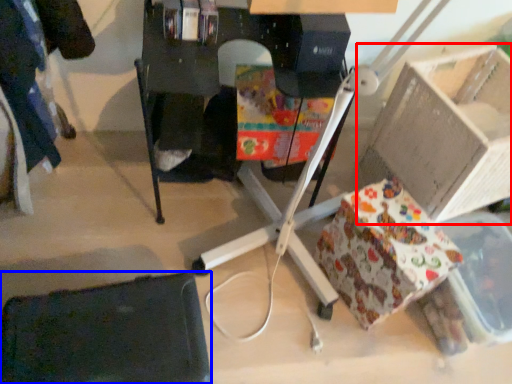
Question: Which of the following is the farthest to the observer, cardboard box (highlighted by a red box) or swivel chair (highlighted by a blue box)?

Choices:
 (A) cardboard box
 (B) swivel chair

Answer: (A)